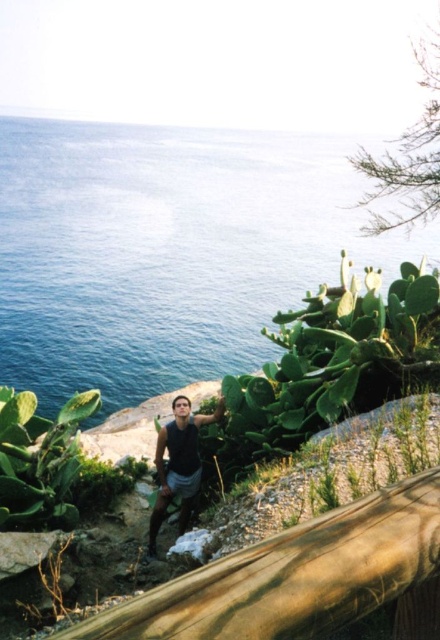
You are a photographer trying to capture the man in the matte black tank top at center while ensuring the blue water at upper left is visible in the frame. Based on their positions, which direction should you move your camera to include both subjects?

The blue water at upper left is to the left of the matte black tank top at center. To include both, move your camera slightly to the right so that the matte black tank top at center remains centered while the blue water at upper left stays within the frame.

You are a photographer trying to frame a shot of the blue water at upper left and the matte black tank top at center. Which object occupies a larger portion of the frame horizontally?

The blue water at upper left is wider than the matte black tank top at center, so it occupies a larger horizontal portion of the frame.

You are a photographer trying to capture a landscape shot. You notice the blue water at upper left and the matte black tank top at center. Which object appears taller in the image?

The blue water at upper left is taller than the matte black tank top at center.